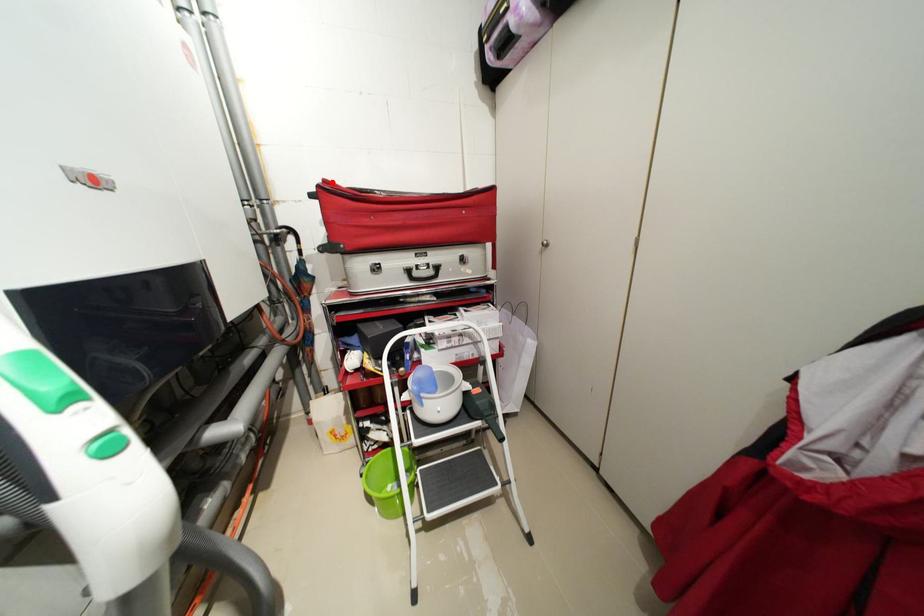
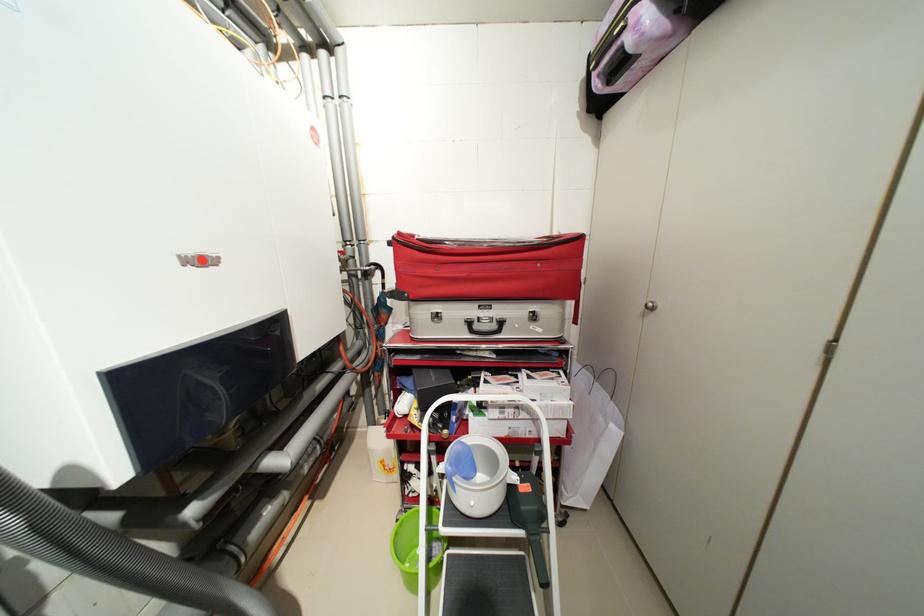
Find the pixel in the second image that matches the highlighted location in the first image.

(407, 235)